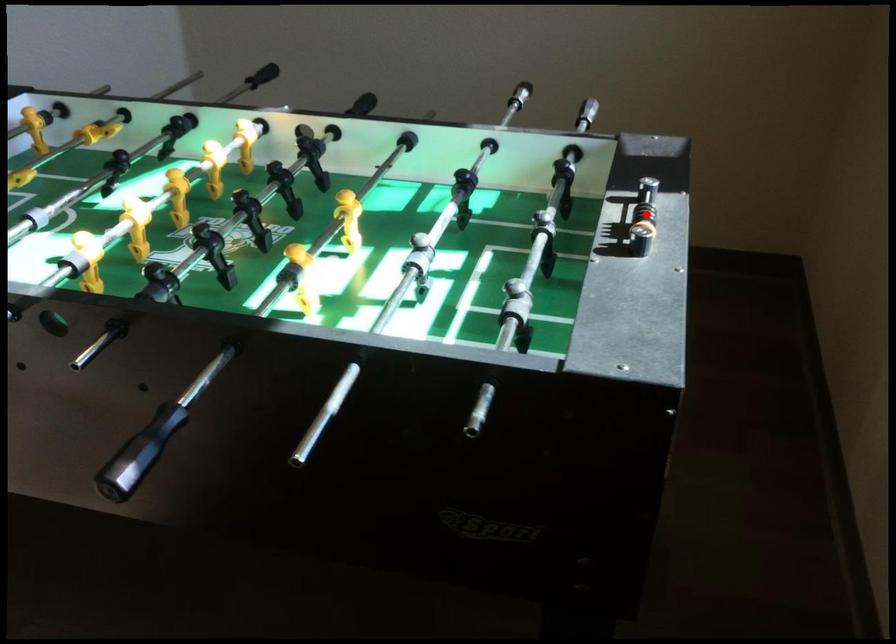
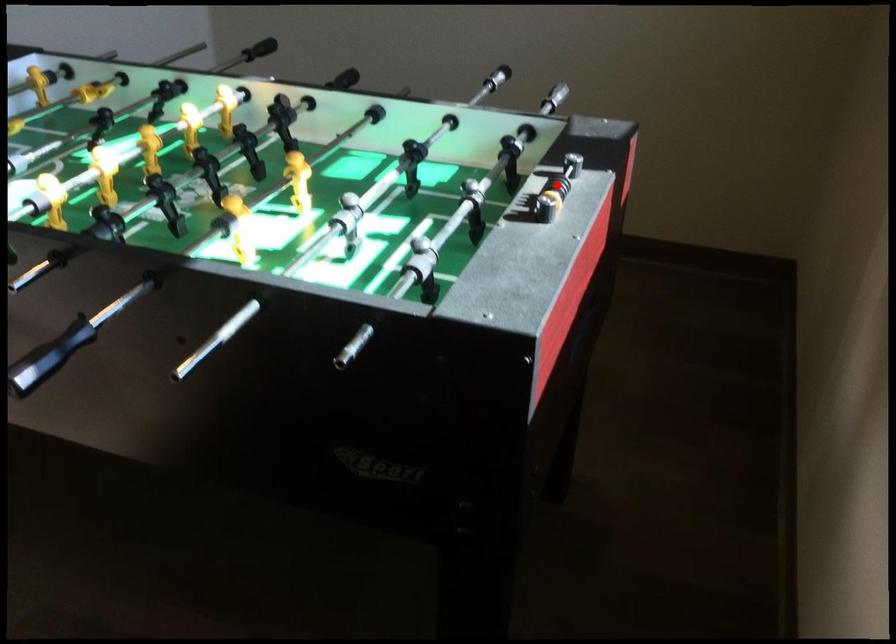
I am providing you with two images of the same scene from different viewpoints. A red point is marked on the first image and another point is marked on the second image. Are the points marked in image1 and image2 representing the same 3D position?

Yes